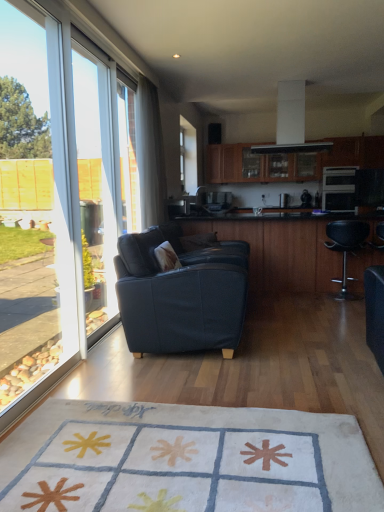
Question: Does matte black oven at right have a lesser width compared to transparent glass window screen at left?

Choices:
 (A) yes
 (B) no

Answer: (B)

Question: Could transparent glass window screen at left be considered to be inside matte black oven at right?

Choices:
 (A) no
 (B) yes

Answer: (A)

Question: Is matte black oven at right taller than transparent glass window screen at left?

Choices:
 (A) no
 (B) yes

Answer: (A)

Question: From a real-world perspective, is matte black oven at right located higher than transparent glass window screen at left?

Choices:
 (A) yes
 (B) no

Answer: (B)

Question: Is matte black oven at right to the right of transparent glass window screen at left from the viewer's perspective?

Choices:
 (A) yes
 (B) no

Answer: (A)

Question: From the image's perspective, is transparent glass window at left positioned above or below black glossy table at center?

Choices:
 (A) below
 (B) above

Answer: (B)

Question: In terms of height, does transparent glass window at left look taller or shorter compared to black glossy table at center?

Choices:
 (A) short
 (B) tall

Answer: (B)

Question: Does point (18, 26) appear closer or farther from the camera than point (261, 257)?

Choices:
 (A) farther
 (B) closer

Answer: (B)

Question: Would you say transparent glass window at left is inside or outside black glossy table at center?

Choices:
 (A) inside
 (B) outside

Answer: (B)

Question: From the image's perspective, is dark blue fabric couch at center positioned above or below black glossy table at center?

Choices:
 (A) above
 (B) below

Answer: (B)

Question: Is point (130, 236) positioned closer to the camera than point (291, 287)?

Choices:
 (A) closer
 (B) farther

Answer: (A)

Question: Visually, is dark blue fabric couch at center positioned to the left or to the right of black glossy table at center?

Choices:
 (A) left
 (B) right

Answer: (A)

Question: Considering the positions of dark blue fabric couch at center and black glossy table at center in the image, is dark blue fabric couch at center bigger or smaller than black glossy table at center?

Choices:
 (A) big
 (B) small

Answer: (B)

Question: In terms of width, does transparent glass window at left look wider or thinner when compared to white glossy exhaust hood at upper center?

Choices:
 (A) thin
 (B) wide

Answer: (A)

Question: From a real-world perspective, is transparent glass window at left positioned above or below white glossy exhaust hood at upper center?

Choices:
 (A) below
 (B) above

Answer: (A)